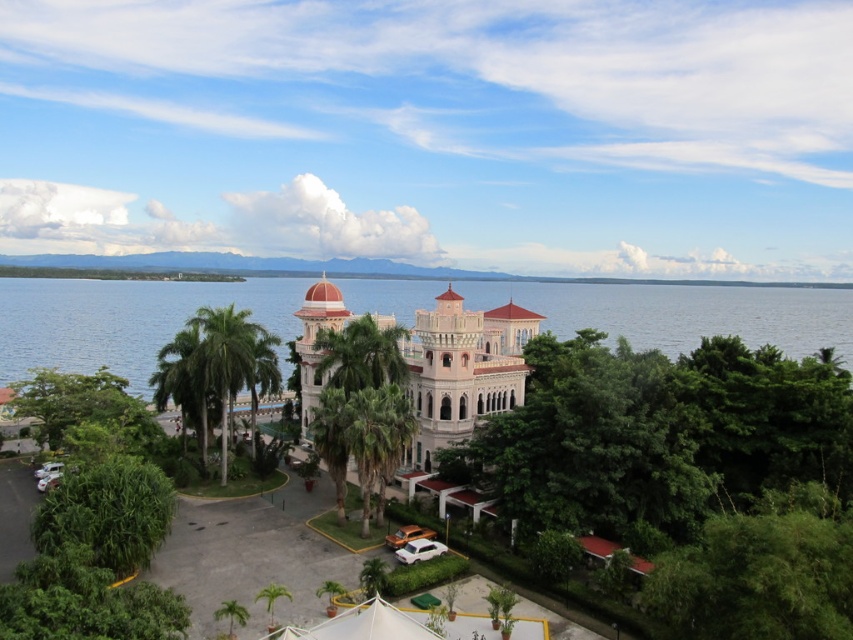
You are standing at the entrance of the grand building and want to take a photo of the green leafy tree at center. Where should you position yourself to capture the tree in the frame?

The green leafy tree at center is located at point 0.744 on the x axis and 0.808 on the y axis, so you should position yourself facing the center area of the building to capture it in your photo.

You are standing in front of the grand building and want to take a photo of the green leafy tree at center without any obstructions. Where should you position yourself to ensure the tree is centered in your photo?

To center the green leafy tree at center in your photo without obstructions, position yourself directly in front of the tree at point (x=688, y=476).

You are standing in front of the grand building and want to take a photo that includes both the green leafy tree at center and the matte pink stone palace at center. Based on their positions, where should you position yourself to ensure both are in the frame?

Since the green leafy tree at center is located below the matte pink stone palace at center, you should position yourself at a lower angle or closer to the ground to capture both the tree and the palace in the same frame.